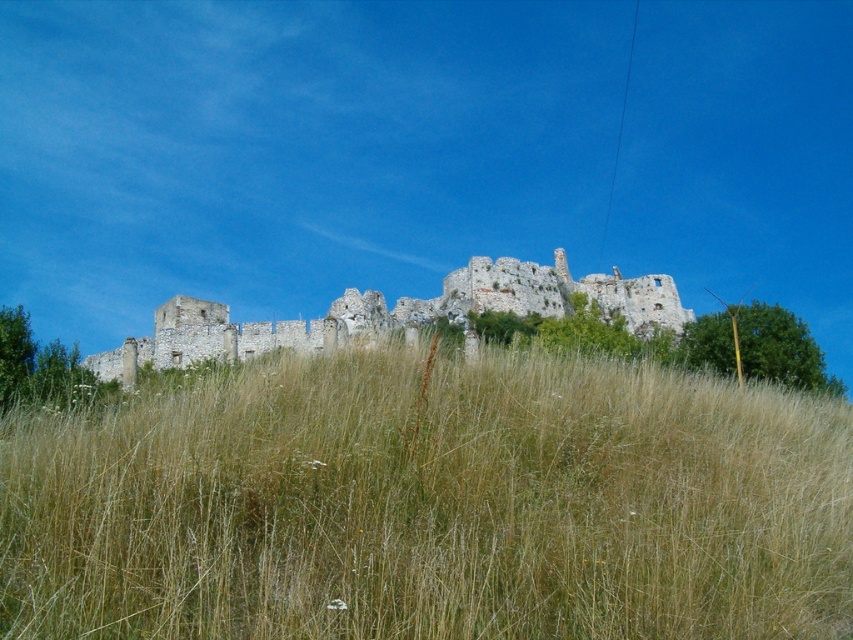
You are a hiker standing at the base of the hill. You want to take a photo of the weathered stone ruins at center while standing on the brown dry grass at center. Is this possible?

The brown dry grass at center is in front of the weathered stone ruins at center, so yes, you can stand on the brown dry grass at center and take a photo of the weathered stone ruins at center.

You are standing in a field of brown dry grass at center and looking towards the weathered stone ruins at center. Which object is located to your right?

The weathered stone ruins at center are located to your right since the brown dry grass at center is positioned on the left side of them.